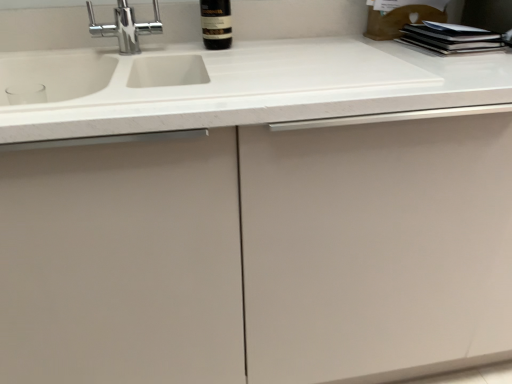
Question: In terms of width, does dark glass bottle at upper center look wider or thinner when compared to white matte countertop at center?

Choices:
 (A) thin
 (B) wide

Answer: (A)

Question: From the image's perspective, is dark glass bottle at upper center above or below white matte countertop at center?

Choices:
 (A) above
 (B) below

Answer: (A)

Question: From their relative heights in the image, would you say dark glass bottle at upper center is taller or shorter than white matte countertop at center?

Choices:
 (A) short
 (B) tall

Answer: (B)

Question: From their relative heights in the image, would you say white matte countertop at center is taller or shorter than dark glass bottle at upper center?

Choices:
 (A) tall
 (B) short

Answer: (B)

Question: Based on their sizes in the image, would you say white matte countertop at center is bigger or smaller than dark glass bottle at upper center?

Choices:
 (A) big
 (B) small

Answer: (A)

Question: Is white matte countertop at center wider or thinner than dark glass bottle at upper center?

Choices:
 (A) thin
 (B) wide

Answer: (B)

Question: Is white matte countertop at center in front of or behind dark glass bottle at upper center in the image?

Choices:
 (A) behind
 (B) front

Answer: (B)